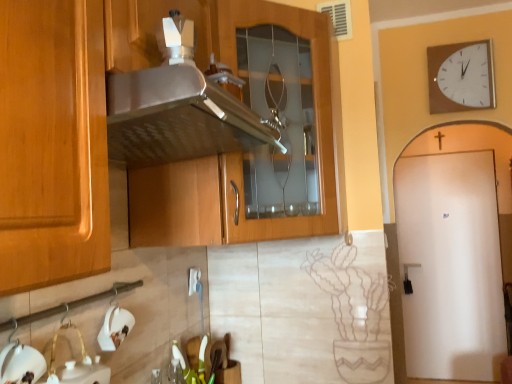
Question: Considering the relative sizes of satin wood cabinet at center and white matte sink at lower left in the image provided, is satin wood cabinet at center thinner than white matte sink at lower left?

Choices:
 (A) no
 (B) yes

Answer: (A)

Question: Would you consider satin wood cabinet at center to be distant from white matte sink at lower left?

Choices:
 (A) yes
 (B) no

Answer: (B)

Question: Can you confirm if satin wood cabinet at center is positioned to the right of white matte sink at lower left?

Choices:
 (A) yes
 (B) no

Answer: (A)

Question: Is satin wood cabinet at center bigger than white matte sink at lower left?

Choices:
 (A) yes
 (B) no

Answer: (A)

Question: Can you confirm if satin wood cabinet at center is smaller than white matte sink at lower left?

Choices:
 (A) no
 (B) yes

Answer: (A)

Question: Would you say satin wood cabinet at center is inside or outside white matte sink at lower left?

Choices:
 (A) inside
 (B) outside

Answer: (B)

Question: Looking at their shapes, would you say satin wood cabinet at center is wider or thinner than white matte sink at lower left?

Choices:
 (A) thin
 (B) wide

Answer: (B)

Question: In the image, is satin wood cabinet at center on the left side or the right side of white matte sink at lower left?

Choices:
 (A) right
 (B) left

Answer: (A)

Question: Does point (131, 94) appear closer or farther from the camera than point (55, 342)?

Choices:
 (A) closer
 (B) farther

Answer: (A)

Question: From their relative heights in the image, would you say satin wood cabinet at center is taller or shorter than white wooden wall clock at upper right?

Choices:
 (A) short
 (B) tall

Answer: (B)

Question: Is point (146, 82) closer or farther from the camera than point (466, 97)?

Choices:
 (A) closer
 (B) farther

Answer: (A)

Question: From a real-world perspective, is satin wood cabinet at center physically located above or below white wooden wall clock at upper right?

Choices:
 (A) above
 (B) below

Answer: (B)

Question: In terms of size, does satin wood cabinet at center appear bigger or smaller than white wooden wall clock at upper right?

Choices:
 (A) big
 (B) small

Answer: (A)

Question: Is point (66, 369) closer or farther from the camera than point (101, 266)?

Choices:
 (A) closer
 (B) farther

Answer: (B)

Question: Relative to satin wood cabinet at center, is white matte sink at lower left in front or behind?

Choices:
 (A) front
 (B) behind

Answer: (A)